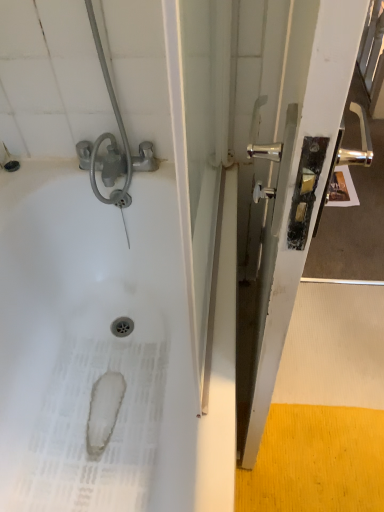
Looking at this image, measure the distance between point (258, 402) and camera.

Point (258, 402) and camera are 33.07 inches apart from each other.

This screenshot has height=512, width=384. Describe the element at coordinates (299, 176) in the screenshot. I see `metallic silver handle at right` at that location.

The width and height of the screenshot is (384, 512). In order to click on metallic silver handle at right in this screenshot , I will do `click(299, 176)`.

In the scene shown: Measure the distance between white glossy bathtub at upper left and camera.

The distance of white glossy bathtub at upper left from camera is 27.91 inches.

Locate an element on the screen. white glossy bathtub at upper left is located at coordinates (92, 344).

What do you see at coordinates (92, 344) in the screenshot?
I see `white glossy bathtub at upper left` at bounding box center [92, 344].

The width and height of the screenshot is (384, 512). Find the location of `metallic silver handle at right`. metallic silver handle at right is located at coordinates (299, 176).

Which object is positioned more to the left, metallic silver handle at right or white glossy bathtub at upper left?

white glossy bathtub at upper left is more to the left.

Considering the positions of objects metallic silver handle at right and white glossy bathtub at upper left in the image provided, who is behind, metallic silver handle at right or white glossy bathtub at upper left?

white glossy bathtub at upper left is more distant.

Which is in front, point (281, 125) or point (30, 175)?

The point (281, 125) is in front.

From the image's perspective, would you say metallic silver handle at right is positioned over white glossy bathtub at upper left?

Yes, from the image's perspective, metallic silver handle at right is on top of white glossy bathtub at upper left.

From a real-world perspective, is metallic silver handle at right positioned under white glossy bathtub at upper left based on gravity?

Incorrect, from a real-world perspective, metallic silver handle at right is higher than white glossy bathtub at upper left.

Does metallic silver handle at right have a lesser width compared to white glossy bathtub at upper left?

Indeed, metallic silver handle at right has a lesser width compared to white glossy bathtub at upper left.

Does metallic silver handle at right have a greater height compared to white glossy bathtub at upper left?

Correct, metallic silver handle at right is much taller as white glossy bathtub at upper left.

Looking at the image, does metallic silver handle at right seem bigger or smaller compared to white glossy bathtub at upper left?

Clearly, metallic silver handle at right is smaller in size than white glossy bathtub at upper left.

Is white glossy bathtub at upper left inside metallic silver handle at right?

No, metallic silver handle at right does not contain white glossy bathtub at upper left.

Is metallic silver handle at right in contact with white glossy bathtub at upper left?

No, metallic silver handle at right is not with white glossy bathtub at upper left.

Is metallic silver handle at right turned away from white glossy bathtub at upper left?

Yes, metallic silver handle at right is positioned with its back facing white glossy bathtub at upper left.

Where is `screen door on the right of white glossy bathtub at upper left`? Image resolution: width=384 pixels, height=512 pixels. screen door on the right of white glossy bathtub at upper left is located at coordinates (299, 176).

Is white glossy bathtub at upper left to the left or to the right of metallic silver handle at right in the image?

In the image, white glossy bathtub at upper left appears on the left side of metallic silver handle at right.

Does white glossy bathtub at upper left lie in front of metallic silver handle at right?

No, white glossy bathtub at upper left is further to the viewer.

Between point (39, 375) and point (293, 108), which one is positioned in front?

Point (293, 108)

From the image's perspective, is white glossy bathtub at upper left above or below metallic silver handle at right?

white glossy bathtub at upper left is below metallic silver handle at right.

From a real-world perspective, who is located lower, white glossy bathtub at upper left or metallic silver handle at right?

white glossy bathtub at upper left, from a real-world perspective.

Is white glossy bathtub at upper left wider than metallic silver handle at right?

Yes.

In terms of height, does white glossy bathtub at upper left look taller or shorter compared to metallic silver handle at right?

white glossy bathtub at upper left is shorter than metallic silver handle at right.

Considering the sizes of white glossy bathtub at upper left and metallic silver handle at right in the image, is white glossy bathtub at upper left bigger or smaller than metallic silver handle at right?

Considering their sizes, white glossy bathtub at upper left takes up more space than metallic silver handle at right.

Is metallic silver handle at right a part of white glossy bathtub at upper left?

No, metallic silver handle at right is not surrounded by white glossy bathtub at upper left.

Is white glossy bathtub at upper left next to metallic silver handle at right?

They are not placed beside each other.

Based on the photo, could you tell me if white glossy bathtub at upper left is turned towards metallic silver handle at right?

Yes, white glossy bathtub at upper left faces towards metallic silver handle at right.

What's the angular difference between white glossy bathtub at upper left and metallic silver handle at right's facing directions?

The angle between the facing direction of white glossy bathtub at upper left and the facing direction of metallic silver handle at right is 6.47 degrees.

At what (x,y) coordinates should I click in order to perform the action: click on bath behind the metallic silver handle at right. Please return your answer as a coordinate pair (x, y). Looking at the image, I should click on (92, 344).

At what (x,y) coordinates should I click in order to perform the action: click on screen door above the white glossy bathtub at upper left (from a real-world perspective). Please return your answer as a coordinate pair (x, y). Looking at the image, I should click on (299, 176).

Find the location of a particular element. The width and height of the screenshot is (384, 512). screen door that is in front of the white glossy bathtub at upper left is located at coordinates (299, 176).